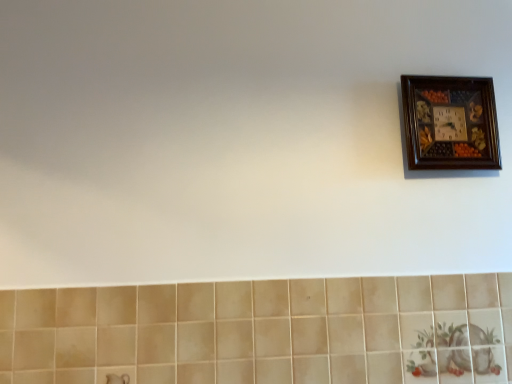
The image size is (512, 384). Identify the location of beige ceramic tile at lower center. (262, 331).

This screenshot has height=384, width=512. What do you see at coordinates (262, 331) in the screenshot?
I see `beige ceramic tile at lower center` at bounding box center [262, 331].

Consider the image. In order to face beige ceramic tile at lower center, should I rotate leftwards or rightwards?

You should look right and rotate roughly 2.715 degrees.

You are a GUI agent. You are given a task and a screenshot of the screen. Output one action in this format:
    pyautogui.click(x=<x>, y=<y>)
    Task: Click on the wooden clock at upper right
    The width and height of the screenshot is (512, 384).
    Given the screenshot: What is the action you would take?
    pyautogui.click(x=450, y=123)

Describe the element at coordinates (450, 123) in the screenshot. I see `wooden clock at upper right` at that location.

Locate an element on the screen. The image size is (512, 384). beige ceramic tile at lower center is located at coordinates (262, 331).

Can you confirm if wooden clock at upper right is positioned to the right of beige ceramic tile at lower center?

Yes, wooden clock at upper right is to the right of beige ceramic tile at lower center.

Which object is closer to the camera taking this photo, wooden clock at upper right or beige ceramic tile at lower center?

beige ceramic tile at lower center.

Which point is more forward, (x=425, y=89) or (x=482, y=350)?

Positioned in front is point (x=482, y=350).

From the image's perspective, which one is positioned lower, wooden clock at upper right or beige ceramic tile at lower center?

beige ceramic tile at lower center is shown below in the image.

From a real-world perspective, which object stands above the other?

wooden clock at upper right.

Considering the sizes of objects wooden clock at upper right and beige ceramic tile at lower center in the image provided, who is thinner, wooden clock at upper right or beige ceramic tile at lower center?

beige ceramic tile at lower center.

Based on the photo, between wooden clock at upper right and beige ceramic tile at lower center, which one has less height?

Standing shorter between the two is wooden clock at upper right.

Is wooden clock at upper right smaller than beige ceramic tile at lower center?

Correct, wooden clock at upper right occupies less space than beige ceramic tile at lower center.

Is wooden clock at upper right inside the boundaries of beige ceramic tile at lower center, or outside?

wooden clock at upper right lies outside beige ceramic tile at lower center.

Does wooden clock at upper right touch beige ceramic tile at lower center?

No, wooden clock at upper right is not making contact with beige ceramic tile at lower center.

Is wooden clock at upper right facing towards beige ceramic tile at lower center?

No, wooden clock at upper right is not oriented towards beige ceramic tile at lower center.

How different are the orientations of wooden clock at upper right and beige ceramic tile at lower center in degrees?

0.366 degrees.

From the picture: How far apart are wooden clock at upper right and beige ceramic tile at lower center?

A distance of 21.09 inches exists between wooden clock at upper right and beige ceramic tile at lower center.

Where is `picture frame above the beige ceramic tile at lower center (from the image's perspective)`? picture frame above the beige ceramic tile at lower center (from the image's perspective) is located at coordinates click(450, 123).

Does beige ceramic tile at lower center appear on the left side of wooden clock at upper right?

Yes.

Who is more distant, beige ceramic tile at lower center or wooden clock at upper right?

wooden clock at upper right is behind.

Which is closer to the camera, [21,333] or [402,76]?

The point [21,333] is closer.

From the image's perspective, is beige ceramic tile at lower center below wooden clock at upper right?

Indeed, from the image's perspective, beige ceramic tile at lower center is shown beneath wooden clock at upper right.

Based on the photo, from a real-world perspective, is beige ceramic tile at lower center above or below wooden clock at upper right?

In terms of real-world spatial position, beige ceramic tile at lower center is below wooden clock at upper right.

Which object is thinner, beige ceramic tile at lower center or wooden clock at upper right?

beige ceramic tile at lower center is thinner.

Does beige ceramic tile at lower center have a greater height compared to wooden clock at upper right?

Correct, beige ceramic tile at lower center is much taller as wooden clock at upper right.

Does beige ceramic tile at lower center have a larger size compared to wooden clock at upper right?

Indeed, beige ceramic tile at lower center has a larger size compared to wooden clock at upper right.

Is beige ceramic tile at lower center completely or partially outside of wooden clock at upper right?

beige ceramic tile at lower center lies outside wooden clock at upper right's area.

Is the surface of beige ceramic tile at lower center in direct contact with wooden clock at upper right?

No, beige ceramic tile at lower center is not touching wooden clock at upper right.

Is beige ceramic tile at lower center facing towards wooden clock at upper right?

No, beige ceramic tile at lower center does not turn towards wooden clock at upper right.

How far apart are beige ceramic tile at lower center and wooden clock at upper right?

A distance of 21.09 inches exists between beige ceramic tile at lower center and wooden clock at upper right.

Find the location of a particular element. picture frame that appears above the beige ceramic tile at lower center (from the image's perspective) is located at coordinates (450, 123).

Where is `ceramic tile on the left side of wooden clock at upper right`? Image resolution: width=512 pixels, height=384 pixels. ceramic tile on the left side of wooden clock at upper right is located at coordinates (262, 331).

You are a GUI agent. You are given a task and a screenshot of the screen. Output one action in this format:
    pyautogui.click(x=<x>, y=<y>)
    Task: Click on the picture frame above the beige ceramic tile at lower center (from the image's perspective)
    
    Given the screenshot: What is the action you would take?
    pyautogui.click(x=450, y=123)